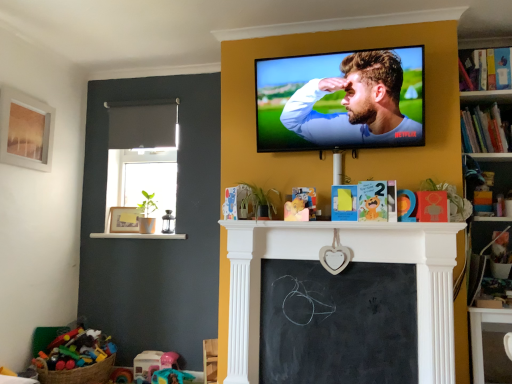
How much space does matte wooden picture frame at left, which is the 2th picture frame from left to right, occupy vertically?

9.43 inches.

Describe the element at coordinates (169, 371) in the screenshot. I see `plastic pink toy at lower center, the first toy when ordered from right to left` at that location.

Identify the location of smooth glossy tv at upper center. (355, 104).

Is matte wooden picture frame at left, which is the 2th picture frame from left to right, oriented towards hardcover book at upper right, which is the second book from top to bottom?

No, matte wooden picture frame at left, which is the 2th picture frame from left to right, does not turn towards hardcover book at upper right, which is the second book from top to bottom.

Is matte wooden picture frame at left, positioned as the first picture frame in bottom-to-top order, to the right of hardcover book at upper right, which is the second book from top to bottom, from the viewer's perspective?

In fact, matte wooden picture frame at left, positioned as the first picture frame in bottom-to-top order, is to the left of hardcover book at upper right, which is the second book from top to bottom.

Does matte wooden picture frame at left, the 1th picture frame from the right, lie in front of hardcover book at upper right, which is the second book from top to bottom?

No, it is behind hardcover book at upper right, which is the second book from top to bottom.

Which is more distant, (x=128, y=231) or (x=468, y=124)?

Positioned behind is point (x=128, y=231).

Is bright multicolored plastic toys at lower left, which appears as the 1th toy when viewed from the left, a part of plastic pink toy at lower center, which appears as the 2th toy when viewed from the left?

No.

Between plastic pink toy at lower center, which appears as the 2th toy when viewed from the left, and bright multicolored plastic toys at lower left, the 2th toy positioned from the right, which one has larger size?

bright multicolored plastic toys at lower left, the 2th toy positioned from the right, is bigger.

From the picture: Is plastic pink toy at lower center, which appears as the 2th toy when viewed from the left, at the right side of bright multicolored plastic toys at lower left, the 2th toy positioned from the right?

Yes, plastic pink toy at lower center, which appears as the 2th toy when viewed from the left, is to the right of bright multicolored plastic toys at lower left, the 2th toy positioned from the right.

Is plastic pink toy at lower center, which appears as the 2th toy when viewed from the left, positioned in front of bright multicolored plastic toys at lower left, the 2th toy positioned from the right?

No, plastic pink toy at lower center, which appears as the 2th toy when viewed from the left, is behind bright multicolored plastic toys at lower left, the 2th toy positioned from the right.

From the image's perspective, between smooth glossy tv at upper center and white glossy ledge at lower left, which one is located above?

smooth glossy tv at upper center is shown above in the image.

Which object is positioned more to the right, smooth glossy tv at upper center or white glossy ledge at lower left?

From the viewer's perspective, smooth glossy tv at upper center appears more on the right side.

Is smooth glossy tv at upper center aimed at white glossy ledge at lower left?

No, smooth glossy tv at upper center is not facing towards white glossy ledge at lower left.

Find the location of a particular element. This screenshot has height=384, width=512. book that is the 2nd one above the bright multicolored plastic toys at lower left, which appears as the 1th toy when viewed from the left (from a real-world perspective) is located at coordinates (485, 69).

Does hardcover book at upper right, the 1th book when ordered from top to bottom, appear on the right side of bright multicolored plastic toys at lower left, the 2th toy positioned from the right?

Indeed, hardcover book at upper right, the 1th book when ordered from top to bottom, is positioned on the right side of bright multicolored plastic toys at lower left, the 2th toy positioned from the right.

From the image's perspective, which is above, hardcover book at upper right, the second book ordered from the bottom, or bright multicolored plastic toys at lower left, the 2th toy positioned from the right?

hardcover book at upper right, the second book ordered from the bottom, appears higher in the image.

Is hardcover book at upper right, which is the second book from top to bottom, turned away from plastic pink toy at lower center, which appears as the 2th toy when viewed from the left?

That's not correct — hardcover book at upper right, which is the second book from top to bottom, is not looking away from plastic pink toy at lower center, which appears as the 2th toy when viewed from the left.

Are hardcover book at upper right, the first book positioned from the bottom, and plastic pink toy at lower center, which appears as the 2th toy when viewed from the left, located far from each other?

Indeed, hardcover book at upper right, the first book positioned from the bottom, is not near plastic pink toy at lower center, which appears as the 2th toy when viewed from the left.

Is hardcover book at upper right, the first book positioned from the bottom, located outside plastic pink toy at lower center, the first toy when ordered from right to left?

Yes, hardcover book at upper right, the first book positioned from the bottom, is not within plastic pink toy at lower center, the first toy when ordered from right to left.

Which object is wider, hardcover book at upper right, the first book positioned from the bottom, or plastic pink toy at lower center, which appears as the 2th toy when viewed from the left?

hardcover book at upper right, the first book positioned from the bottom.

Considering the relative sizes of plastic pink toy at lower center, the first toy when ordered from right to left, and white glossy ledge at lower left in the image provided, is plastic pink toy at lower center, the first toy when ordered from right to left, taller than white glossy ledge at lower left?

Yes.

What's the angular difference between plastic pink toy at lower center, which appears as the 2th toy when viewed from the left, and white glossy ledge at lower left's facing directions?

45.2 degrees.

From the image's perspective, which object appears higher, plastic pink toy at lower center, which appears as the 2th toy when viewed from the left, or white glossy ledge at lower left?

From the image's view, white glossy ledge at lower left is above.

Based on the photo, is the position of bright multicolored plastic toys at lower left, the 2th toy positioned from the right, more distant than that of black fabric curtain at upper left?

That is False.

Does bright multicolored plastic toys at lower left, which appears as the 1th toy when viewed from the left, have a larger size compared to black fabric curtain at upper left?

Indeed, bright multicolored plastic toys at lower left, which appears as the 1th toy when viewed from the left, has a larger size compared to black fabric curtain at upper left.

From the image's perspective, would you say bright multicolored plastic toys at lower left, which appears as the 1th toy when viewed from the left, is shown under black fabric curtain at upper left?

Indeed, from the image's perspective, bright multicolored plastic toys at lower left, which appears as the 1th toy when viewed from the left, is shown beneath black fabric curtain at upper left.

Does bright multicolored plastic toys at lower left, which appears as the 1th toy when viewed from the left, turn towards black fabric curtain at upper left?

No, bright multicolored plastic toys at lower left, which appears as the 1th toy when viewed from the left, is not facing towards black fabric curtain at upper left.

From the image's perspective, count 1st books upward from the matte wooden picture frame at left, positioned as the 2th picture frame in front-to-back order, and point to it. Please provide its 2D coordinates.

[(482, 130)]

This screenshot has height=384, width=512. Identify the location of toy in front of the plastic pink toy at lower center, which appears as the 2th toy when viewed from the left. (75, 350).

Considering their positions, is black fabric curtain at upper left positioned further to black chalkboard at center than plastic pink toy at lower center, the first toy when ordered from right to left?

Based on the image, black fabric curtain at upper left appears to be further to black chalkboard at center.

Considering their positions, is black chalkboard at center positioned closer to white glossy ledge at lower left than black fabric curtain at upper left?

Answer: black fabric curtain at upper left.

Which object lies further to the anchor point matte wooden picture frame at left, positioned as the 2th picture frame in front-to-back order, black chalkboard at center or bright multicolored plastic toys at lower left, the 2th toy positioned from the right?

black chalkboard at center.

Based on the photo, considering their positions, is hardcover book at upper right, the first book positioned from the bottom, positioned closer to black fabric curtain at upper left than smooth glossy tv at upper center?

smooth glossy tv at upper center is positioned closer to the anchor black fabric curtain at upper left.

Based on the photo, based on their spatial positions, is black chalkboard at center or smooth glossy tv at upper center closer to matte wooden picture frame at upper left, the first picture frame viewed from the top?

The object closer to matte wooden picture frame at upper left, the first picture frame viewed from the top, is smooth glossy tv at upper center.

From the image, which object appears to be farther from hardcover book at upper right, which is the second book from top to bottom, plastic pink toy at lower center, which appears as the 2th toy when viewed from the left, or hardcover book at upper right, the second book ordered from the bottom?

Among the two, plastic pink toy at lower center, which appears as the 2th toy when viewed from the left, is located further to hardcover book at upper right, which is the second book from top to bottom.

Considering their positions, is black chalkboard at center positioned closer to plastic pink toy at lower center, which appears as the 2th toy when viewed from the left, than black fabric curtain at upper left?

Among the two, black chalkboard at center is located nearer to plastic pink toy at lower center, which appears as the 2th toy when viewed from the left.

Estimate the real-world distances between objects in this image. Which object is further from matte wooden picture frame at upper left, the first picture frame viewed from the top, bright multicolored plastic toys at lower left, the 2th toy positioned from the right, or white glossy ledge at lower left?

Among the two, bright multicolored plastic toys at lower left, the 2th toy positioned from the right, is located further to matte wooden picture frame at upper left, the first picture frame viewed from the top.

Image resolution: width=512 pixels, height=384 pixels. I want to click on book between black fabric curtain at upper left and hardcover book at upper right, the 1th book when ordered from top to bottom, in the horizontal direction, so click(x=482, y=130).

I want to click on man between black fabric curtain at upper left and plastic pink toy at lower center, the first toy when ordered from right to left, vertically, so click(355, 104).

At what (x,y) coordinates should I click in order to perform the action: click on ledge between matte wooden picture frame at left, which is the 2th picture frame from left to right, and hardcover book at upper right, the first book positioned from the bottom, from left to right. Please return your answer as a coordinate pair (x, y). Looking at the image, I should click on (139, 236).

The height and width of the screenshot is (384, 512). What are the coordinates of `toy that lies between white glossy ledge at lower left and plastic pink toy at lower center, the first toy when ordered from right to left, from top to bottom` in the screenshot? It's located at (75, 350).